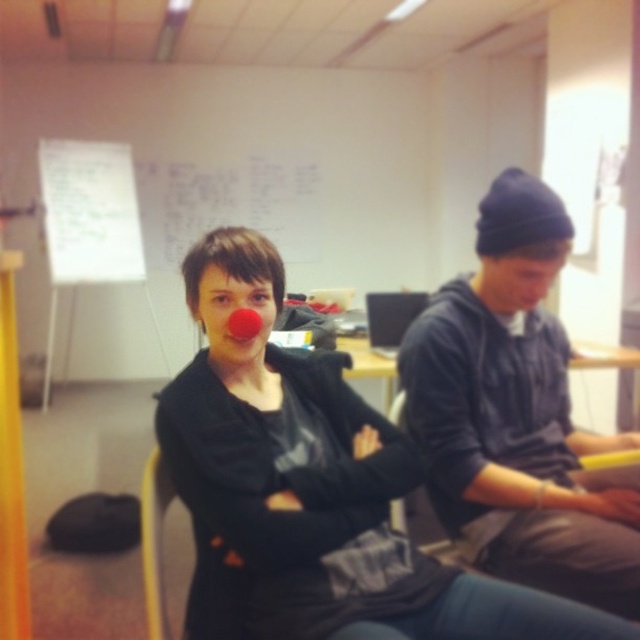
What do you see at coordinates (516, 416) in the screenshot? The height and width of the screenshot is (640, 640). I see `dark gray hoodie at center` at bounding box center [516, 416].

Is dark gray hoodie at center in front of matte black beanie at upper right?

Yes, it is.

Who is more distant from viewer, (424, 419) or (536, 273)?

Point (424, 419)

Find the location of a particular element. The height and width of the screenshot is (640, 640). dark gray hoodie at center is located at coordinates (516, 416).

Does dark gray hoodie at center come in front of matte red nose at center?

Yes, it is.

Between dark gray hoodie at center and matte red nose at center, which one has more height?

dark gray hoodie at center is taller.

The width and height of the screenshot is (640, 640). What do you see at coordinates (516, 416) in the screenshot? I see `dark gray hoodie at center` at bounding box center [516, 416].

The width and height of the screenshot is (640, 640). Find the location of `dark gray hoodie at center`. dark gray hoodie at center is located at coordinates (516, 416).

Looking at this image, can you confirm if matte red nose at center is taller than matte black beanie at upper right?

Yes, matte red nose at center is taller than matte black beanie at upper right.

Does matte red nose at center have a larger size compared to matte black beanie at upper right?

Actually, matte red nose at center might be smaller than matte black beanie at upper right.

Identify the location of matte red nose at center. The image size is (640, 640). (230, 312).

Locate an element on the screen. The image size is (640, 640). matte red nose at center is located at coordinates (230, 312).